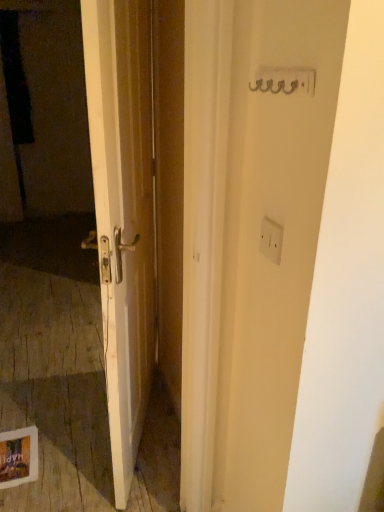
Question: Is transparent plastic screen door at left smaller than white plastic electric outlet at upper right?

Choices:
 (A) no
 (B) yes

Answer: (A)

Question: Is transparent plastic screen door at left aimed at white plastic electric outlet at upper right?

Choices:
 (A) yes
 (B) no

Answer: (A)

Question: From a real-world perspective, is transparent plastic screen door at left positioned over white plastic electric outlet at upper right based on gravity?

Choices:
 (A) yes
 (B) no

Answer: (B)

Question: Is the surface of transparent plastic screen door at left in direct contact with white plastic electric outlet at upper right?

Choices:
 (A) yes
 (B) no

Answer: (B)

Question: Is the depth of transparent plastic screen door at left greater than that of white plastic electric outlet at upper right?

Choices:
 (A) yes
 (B) no

Answer: (A)

Question: From the image's perspective, would you say transparent plastic screen door at left is shown under white plastic electric outlet at upper right?

Choices:
 (A) no
 (B) yes

Answer: (A)

Question: Is white plastic electric outlet at upper right further to the viewer compared to transparent plastic screen door at left?

Choices:
 (A) yes
 (B) no

Answer: (B)

Question: Is white plastic electric outlet at upper right facing towards transparent plastic screen door at left?

Choices:
 (A) no
 (B) yes

Answer: (A)

Question: Considering the relative sizes of white plastic electric outlet at upper right and transparent plastic screen door at left in the image provided, is white plastic electric outlet at upper right thinner than transparent plastic screen door at left?

Choices:
 (A) yes
 (B) no

Answer: (A)

Question: Can you confirm if white plastic electric outlet at upper right is wider than transparent plastic screen door at left?

Choices:
 (A) no
 (B) yes

Answer: (A)

Question: Considering the relative sizes of white plastic electric outlet at upper right and transparent plastic screen door at left in the image provided, is white plastic electric outlet at upper right smaller than transparent plastic screen door at left?

Choices:
 (A) yes
 (B) no

Answer: (A)

Question: Is white plastic electric outlet at upper right taller than transparent plastic screen door at left?

Choices:
 (A) yes
 (B) no

Answer: (B)

Question: From a real-world perspective, is transparent plastic screen door at left above or below white plastic electric outlet at upper right?

Choices:
 (A) below
 (B) above

Answer: (A)